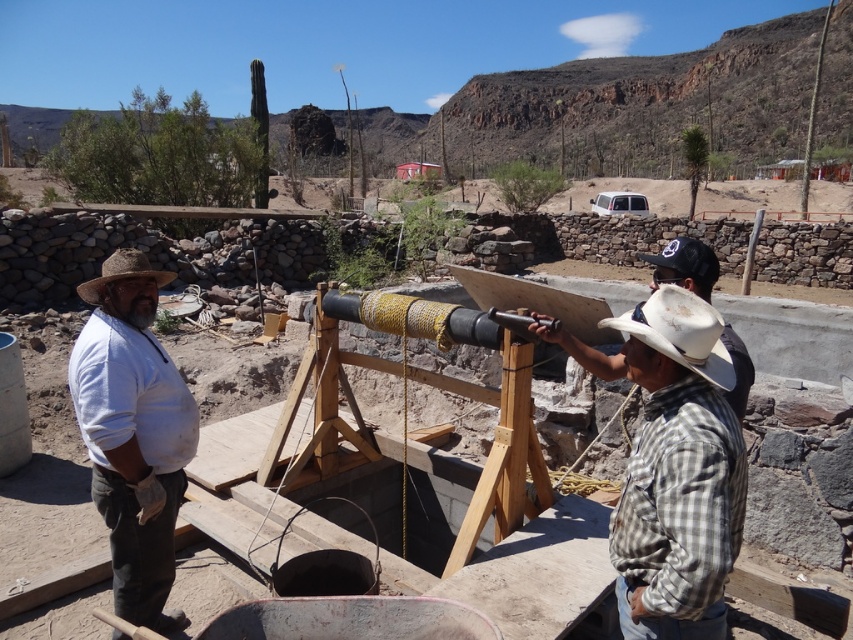
Question: Considering the real-world distances, which object is farthest from the wooden telescope at center?

Choices:
 (A) white matte cowboy hat at right
 (B) white checkered shirt at center
 (C) brown straw cowboy hat at left

Answer: (A)

Question: In this image, where is white checkered shirt at center located relative to white cotton shirt at left?

Choices:
 (A) right
 (B) left

Answer: (A)

Question: Which point is closer to the camera?

Choices:
 (A) wooden telescope at center
 (B) brown straw cowboy hat at left

Answer: (A)

Question: Does white checkered shirt at center have a greater width compared to brown straw cowboy hat at left?

Choices:
 (A) no
 (B) yes

Answer: (A)

Question: In this image, where is white checkered shirt at center located relative to wooden telescope at center?

Choices:
 (A) left
 (B) right

Answer: (B)

Question: Which point is farther from the camera taking this photo?

Choices:
 (A) (119, 256)
 (B) (132, 480)
 (C) (682, 460)

Answer: (A)